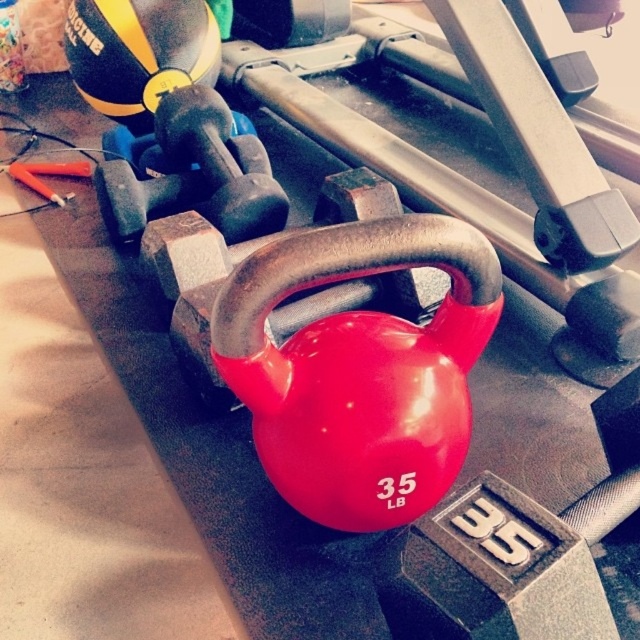
You are organizing the gym equipment and need to place the rubberized red kettlebell at center and the matte black dumbbell at center in a vertical stack. Which one should be placed at the bottom to ensure stability?

The rubberized red kettlebell at center should be placed at the bottom since it is located below the matte black dumbbell at center, indicating it has a larger base for stability.

You are organizing a gym and need to stack the rubberized red kettlebell at center and the matte black dumbbell at center vertically. Based on their heights, which one should be placed at the bottom to ensure stability?

The rubberized red kettlebell at center is taller than the matte black dumbbell at center, so placing the taller kettlebell at the bottom will provide a stable base for the stack.

You are standing in a gym and want to pick up the kettlebell. The gym has a rule that you must stay at least 30 inches away from any equipment to avoid tripping over cables. Is the point at coordinates point (448, 465) within the safe distance required by the gym rules?

The distance between point (448, 465) and the camera is 28.50 inches, which is less than the required 30 inches. Therefore, the point is too close to the equipment and does not meet the gym rule requirements.